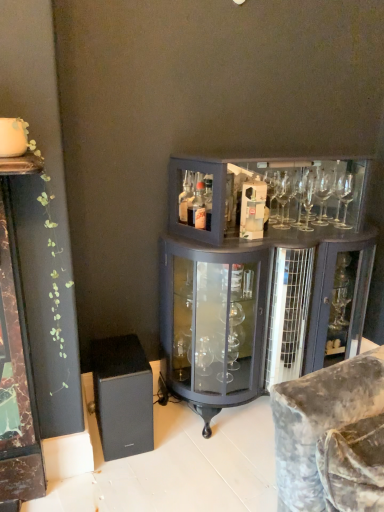
What is the approximate height of black matte speaker at lower left?

black matte speaker at lower left is 15.82 inches tall.

Find the location of a particular element. Image resolution: width=384 pixels, height=512 pixels. black matte speaker at lower left is located at coordinates (122, 396).

The height and width of the screenshot is (512, 384). Describe the element at coordinates (122, 396) in the screenshot. I see `black matte speaker at lower left` at that location.

Locate an element on the screen. The width and height of the screenshot is (384, 512). black matte speaker at lower left is located at coordinates (122, 396).